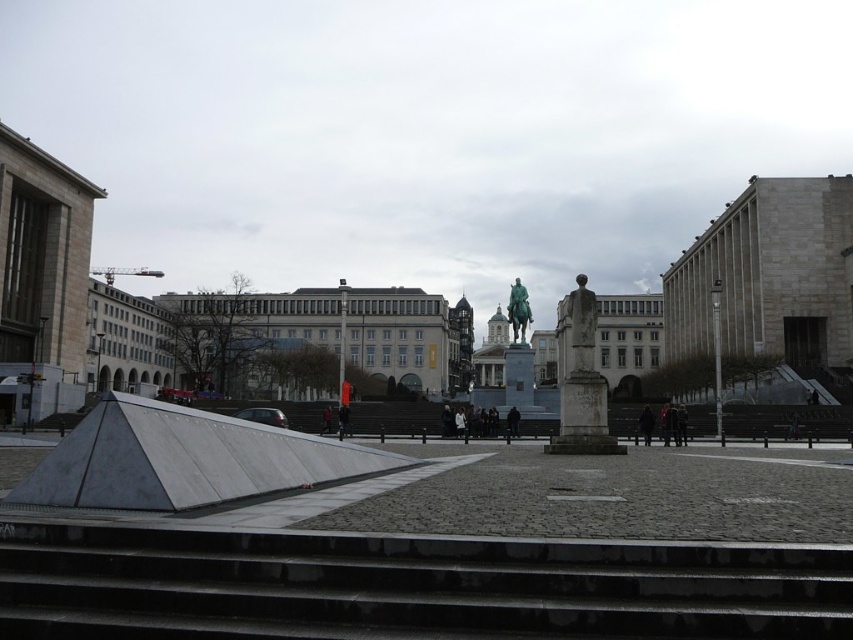
In the scene shown: Can you confirm if bronze statue at center is smaller than white stone statue at center?

Yes.

What do you see at coordinates (582, 385) in the screenshot? The width and height of the screenshot is (853, 640). I see `bronze statue at center` at bounding box center [582, 385].

Locate an element on the screen. The width and height of the screenshot is (853, 640). bronze statue at center is located at coordinates (582, 385).

How distant is white stone statue at center from gold polished statue at center?

The distance of white stone statue at center from gold polished statue at center is 73.10 meters.

Is point (593, 364) more distant than point (527, 307)?

No, (593, 364) is closer to viewer.

Image resolution: width=853 pixels, height=640 pixels. Find the location of `white stone statue at center`. white stone statue at center is located at coordinates (577, 330).

Can you confirm if bronze statue at center is smaller than gold polished statue at center?

Actually, bronze statue at center might be larger than gold polished statue at center.

Is point (569, 397) positioned behind point (526, 296)?

No, (569, 397) is closer to viewer.

You are a GUI agent. You are given a task and a screenshot of the screen. Output one action in this format:
    pyautogui.click(x=<x>, y=<y>)
    Task: Click on the bronze statue at center
    Image resolution: width=853 pixels, height=640 pixels.
    Given the screenshot: What is the action you would take?
    pyautogui.click(x=582, y=385)